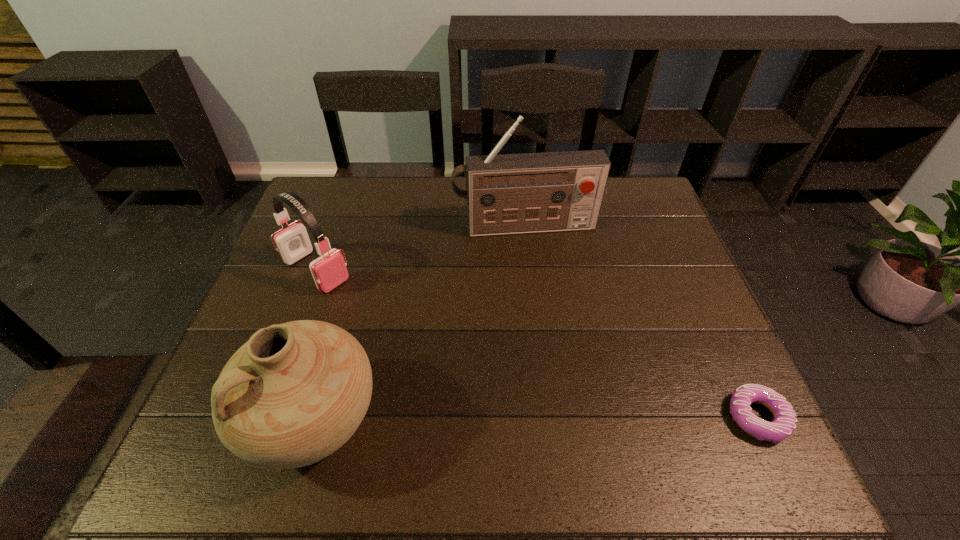
Find the location of a particular element. This screenshot has height=540, width=960. object positioned at the near left corner is located at coordinates (296, 392).

Where is `object that is at the near right corner`? object that is at the near right corner is located at coordinates (784, 423).

In the image, there is a desktop. Where is `blank space at the far edge`? blank space at the far edge is located at coordinates (418, 188).

Find the location of `free space at the near edge`. free space at the near edge is located at coordinates (419, 400).

Identify the location of vacant space at the right edge. (653, 301).

Where is `vacant region at the far right corner of the desktop`? This screenshot has height=540, width=960. vacant region at the far right corner of the desktop is located at coordinates (626, 188).

Where is `vacant area at the near right corner of the desktop`? This screenshot has height=540, width=960. vacant area at the near right corner of the desktop is located at coordinates (688, 411).

You are a GUI agent. You are given a task and a screenshot of the screen. Output one action in this format:
    pyautogui.click(x=<x>, y=<y>)
    Task: Click on the vacant space in between the earphone and the doughnut
    Image resolution: width=960 pixels, height=540 pixels.
    Given the screenshot: What is the action you would take?
    pyautogui.click(x=537, y=344)

The height and width of the screenshot is (540, 960). What are the coordinates of `vacant region between the radio receiver and the doughnut` in the screenshot? It's located at (641, 322).

This screenshot has width=960, height=540. What are the coordinates of `vacant region between the rightmost object and the tallest object` in the screenshot? It's located at (641, 322).